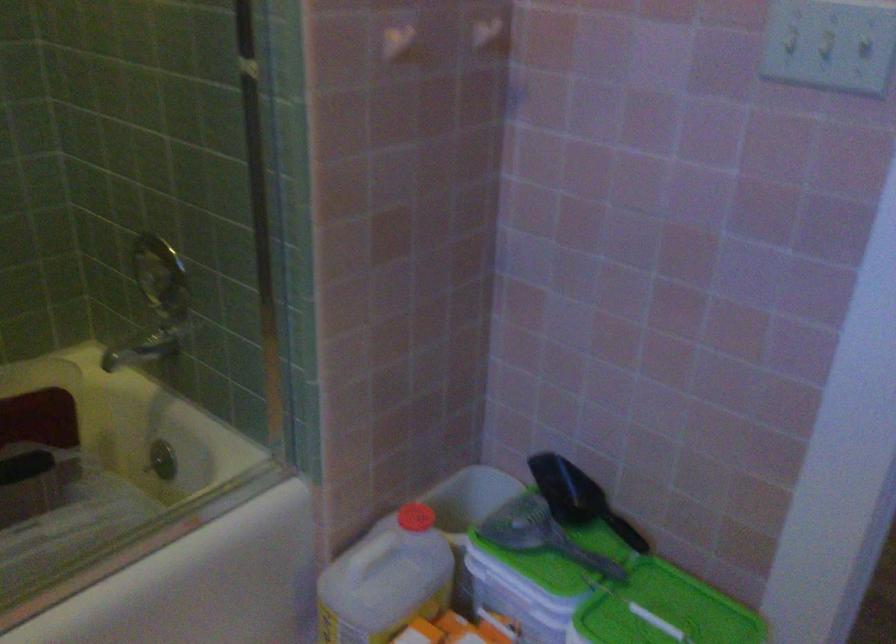
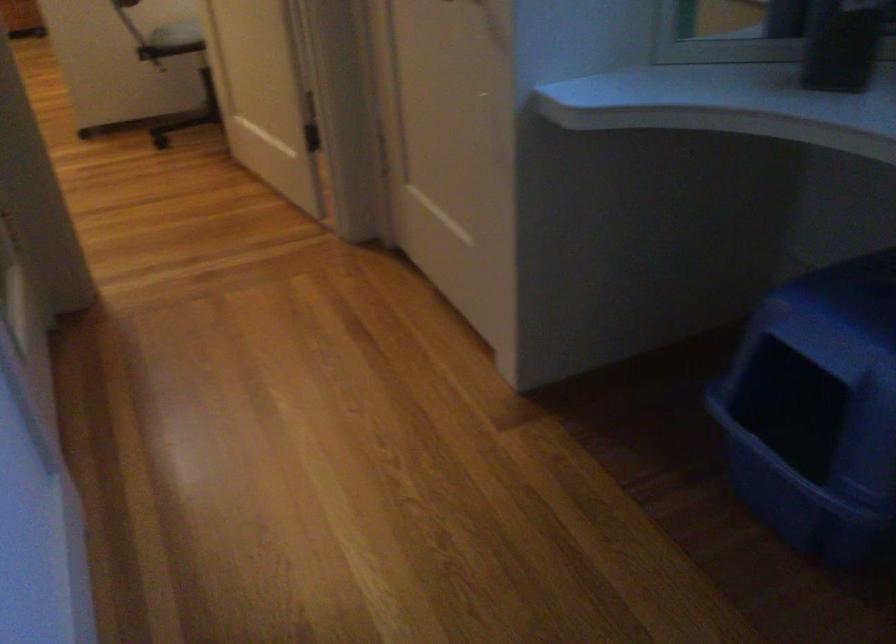
In a continuous first-person perspective shot, in which direction is the camera moving?

The cameraman moved toward right, forward.